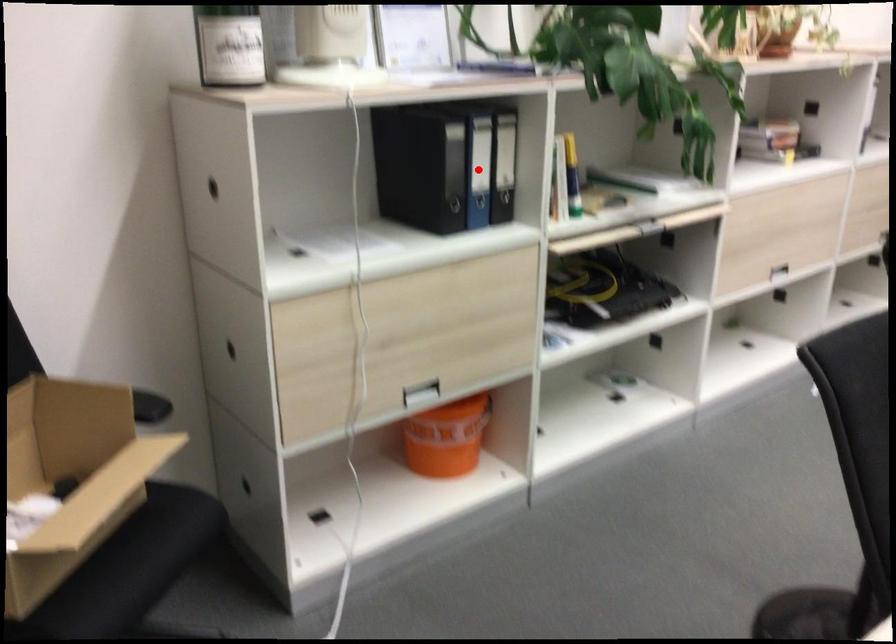
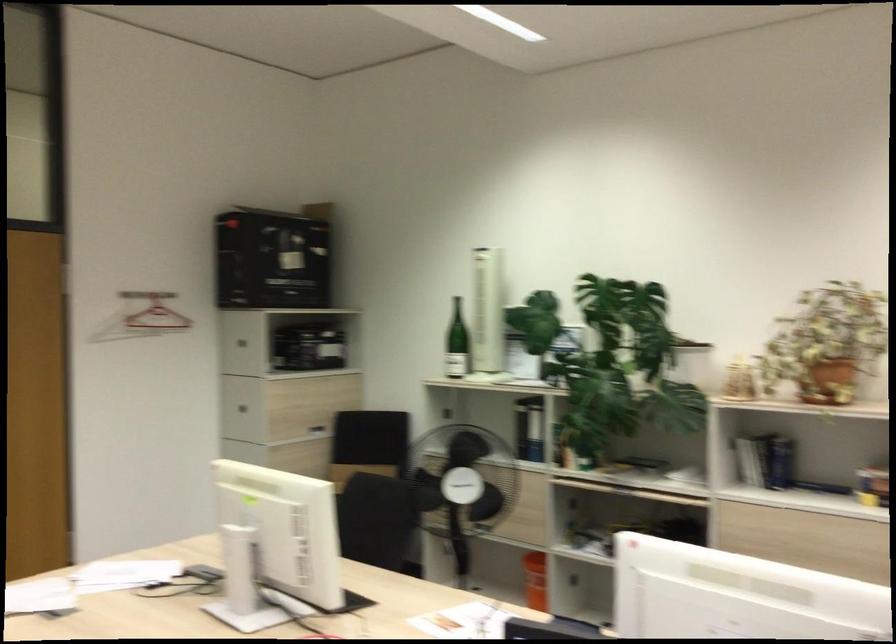
Question: I am providing you with two images of the same scene from different viewpoints. A red point is marked on the first image. Is the red point's position out of view in image 2?

Choices:
 (A) Yes
 (B) No

Answer: (A)